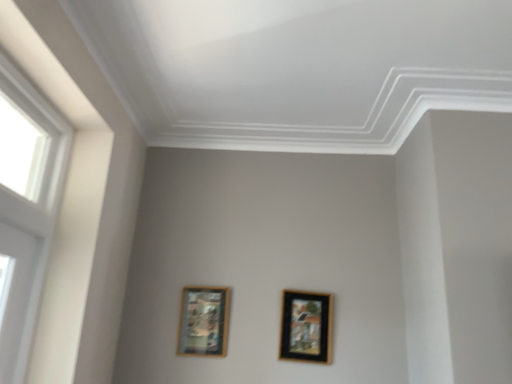
Question: Considering the positions of wooden framed artwork at lower left, positioned as the 2th picture frame in right-to-left order, and black glossy picture frame at center, which appears as the second picture frame when viewed from the left, in the image, is wooden framed artwork at lower left, positioned as the 2th picture frame in right-to-left order, taller or shorter than black glossy picture frame at center, which appears as the second picture frame when viewed from the left,?

Choices:
 (A) short
 (B) tall

Answer: (A)

Question: Is point (188, 322) closer or farther from the camera than point (330, 301)?

Choices:
 (A) farther
 (B) closer

Answer: (B)

Question: Based on their relative distances, which object is nearer to the wooden framed artwork at lower left, which is counted as the 1th picture frame, starting from the left?

Choices:
 (A) white plastic window at left
 (B) black glossy picture frame at center, which appears as the second picture frame when viewed from the left

Answer: (B)

Question: Which of these objects is positioned farthest from the white plastic window at left?

Choices:
 (A) wooden framed artwork at lower left, positioned as the 2th picture frame in right-to-left order
 (B) black glossy picture frame at center, marked as the 1th picture frame in a right-to-left arrangement

Answer: (B)